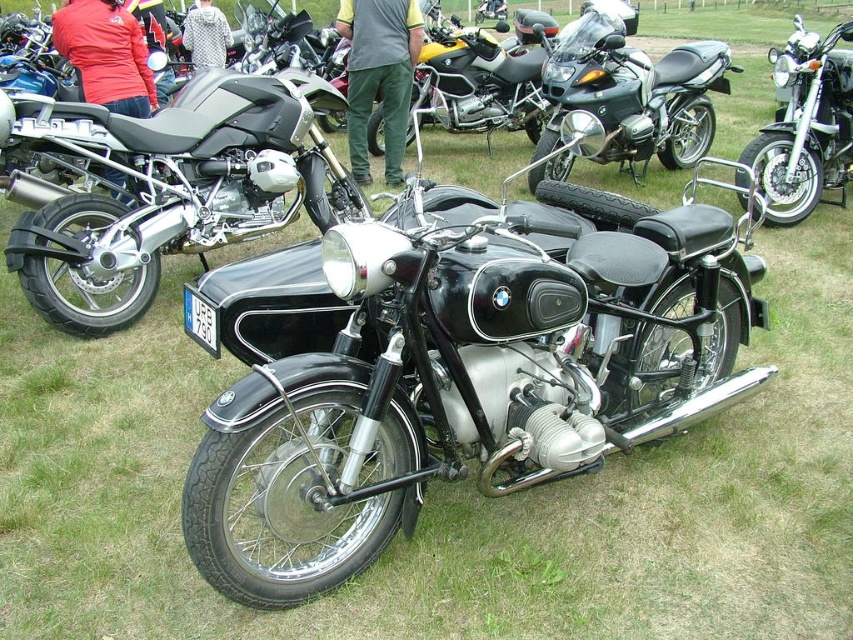
Can you confirm if black matte motorcycle at center is shorter than shiny chrome motorcycle at center?

No.

Who is more forward, (276, 214) or (790, 113)?

Point (276, 214) is in front.

Image resolution: width=853 pixels, height=640 pixels. I want to click on black matte motorcycle at center, so click(x=172, y=195).

Does red fabric jacket at upper left lie in front of brushed metal jacket at upper center?

Yes.

Is point (97, 70) positioned in front of point (219, 51)?

Yes, point (97, 70) is in front of point (219, 51).

Which is in front, point (102, 100) or point (209, 42)?

Point (102, 100) is in front.

At what (x,y) coordinates should I click in order to perform the action: click on red fabric jacket at upper left. Please return your answer as a coordinate pair (x, y). Image resolution: width=853 pixels, height=640 pixels. Looking at the image, I should click on (105, 54).

Is shiny black motorcycle at center bigger than brushed metal jacket at upper center?

Correct, shiny black motorcycle at center is larger in size than brushed metal jacket at upper center.

Which is behind, point (635, 51) or point (222, 38)?

Positioned behind is point (222, 38).

Identify the location of shiny black motorcycle at center. Image resolution: width=853 pixels, height=640 pixels. (633, 93).